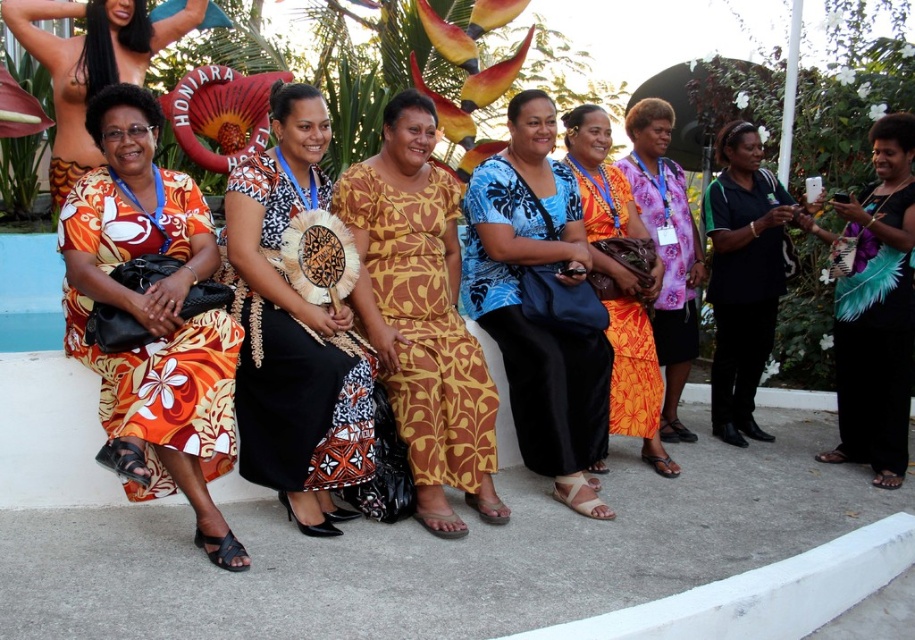
Question: Does brown printed dress at center have a greater width compared to teal feathered dress at right?

Choices:
 (A) no
 (B) yes

Answer: (B)

Question: Which of the following is the closest to the observer?

Choices:
 (A) matte black dress at center
 (B) brown printed dress at center
 (C) teal feathered dress at right
 (D) matte orange dress at center

Answer: (A)

Question: Which object appears farthest from the camera in this image?

Choices:
 (A) black matte shirt at right
 (B) blue printed dress at center

Answer: (A)

Question: Observing the image, what is the correct spatial positioning of teal feathered dress at right in reference to floral print dress at center?

Choices:
 (A) left
 (B) right

Answer: (B)

Question: Is orange printed fabric dress at left positioned before brown printed dress at center?

Choices:
 (A) yes
 (B) no

Answer: (A)

Question: Which of these objects is positioned closest to the brown printed dress at center?

Choices:
 (A) black matte shirt at right
 (B) teal feathered dress at right

Answer: (A)